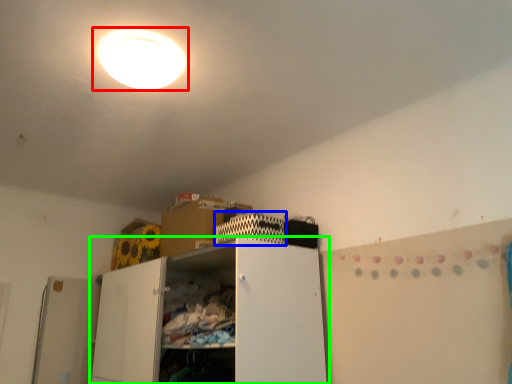
Question: Which is nearer to the lamp (highlighted by a red box)? cabinet (highlighted by a blue box) or cabinetry (highlighted by a green box).

Choices:
 (A) cabinet
 (B) cabinetry

Answer: (A)